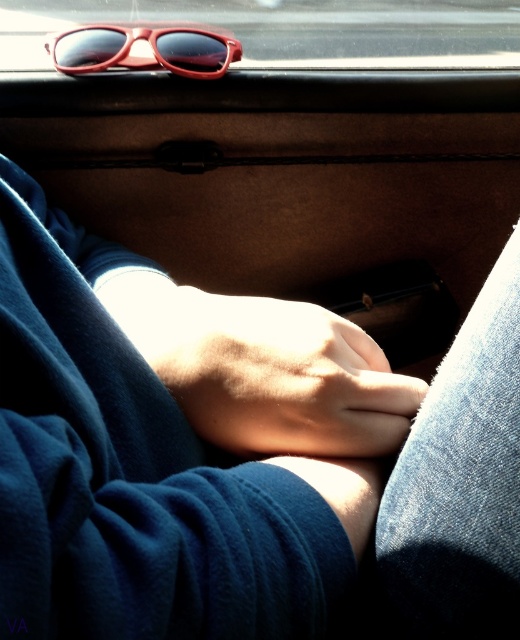
Can you confirm if smooth skin hand at center is smaller than matte plastic sunglasses at upper center?

Correct, smooth skin hand at center occupies less space than matte plastic sunglasses at upper center.

Is smooth skin hand at center to the left of matte plastic sunglasses at upper center from the viewer's perspective?

Correct, you'll find smooth skin hand at center to the left of matte plastic sunglasses at upper center.

Which is behind, point (323, 417) or point (419, 20)?

Point (419, 20)

Locate an element on the screen. smooth skin hand at center is located at coordinates [279, 376].

Who is lower down, smooth skin hand at center or matte red sunglasses at upper center?

smooth skin hand at center

What are the coordinates of `smooth skin hand at center` in the screenshot? It's located at (279, 376).

Locate an element on the screen. The height and width of the screenshot is (640, 520). smooth skin hand at center is located at coordinates (279, 376).

Between matte plastic sunglasses at upper center and matte red sunglasses at upper center, which one appears on the right side from the viewer's perspective?

matte plastic sunglasses at upper center

Between matte plastic sunglasses at upper center and matte red sunglasses at upper center, which one has less height?

Standing shorter between the two is matte red sunglasses at upper center.

What do you see at coordinates (292, 29) in the screenshot?
I see `matte plastic sunglasses at upper center` at bounding box center [292, 29].

The width and height of the screenshot is (520, 640). Identify the location of matte plastic sunglasses at upper center. (292, 29).